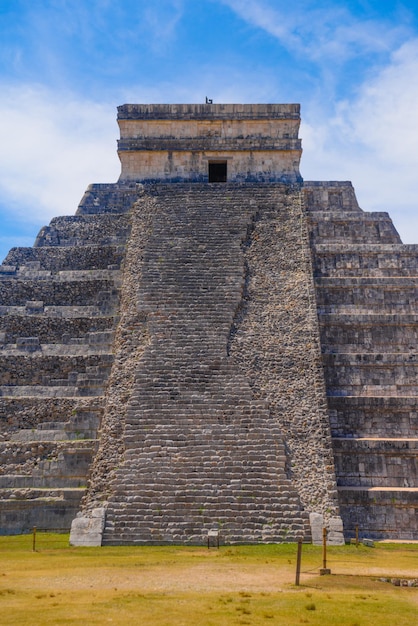
Locate an element on the screen. The height and width of the screenshot is (626, 418). entrance is located at coordinates (215, 168).